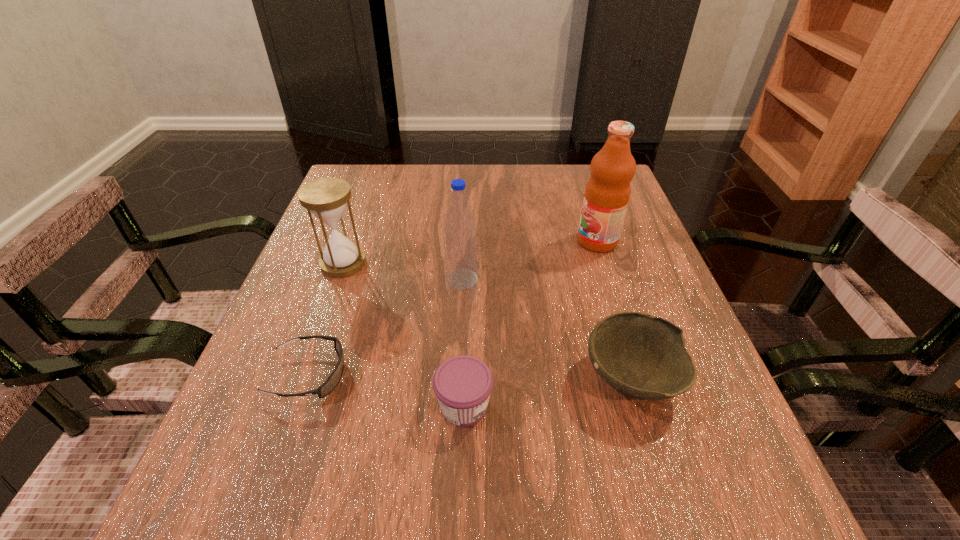
The height and width of the screenshot is (540, 960). What are the coordinates of `the tallest object` in the screenshot? It's located at (607, 193).

You are a GUI agent. You are given a task and a screenshot of the screen. Output one action in this format:
    pyautogui.click(x=<x>, y=<y>)
    Task: Click on the second tallest object
    
    Given the screenshot: What is the action you would take?
    pyautogui.click(x=460, y=245)

This screenshot has height=540, width=960. Identify the location of hourglass. (326, 198).

You are a GUI agent. You are given a task and a screenshot of the screen. Output one action in this format:
    pyautogui.click(x=<x>, y=<y>)
    Task: Click on the bowl
    The height and width of the screenshot is (540, 960).
    Given the screenshot: What is the action you would take?
    (x=643, y=357)

Find the location of a particular element. jam is located at coordinates (463, 384).

Identify the location of the shortest object. (329, 385).

Image resolution: width=960 pixels, height=540 pixels. Find the location of `blank area located on the front label of the tallest object`. blank area located on the front label of the tallest object is located at coordinates (408, 241).

The height and width of the screenshot is (540, 960). What are the coordinates of `blank space located 0.170m on the front label of the tallest object` in the screenshot? It's located at (503, 241).

Locate an element on the screen. This screenshot has width=960, height=540. vacant space located on the front label of the tallest object is located at coordinates (525, 241).

Identify the location of free space located 0.330m on the right of the water bottle. (636, 279).